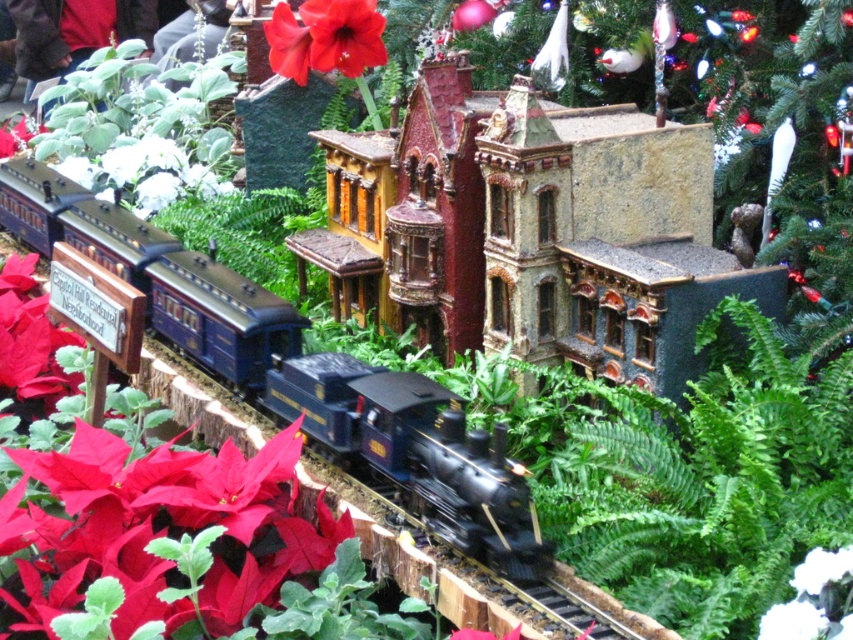
Question: Which of the following is the farthest from the observer?

Choices:
 (A) shiny blue locomotive at center
 (B) red matte poinsettia at upper center

Answer: (B)

Question: Is shiny blue locomotive at center to the right of red matte poinsettia at upper center from the viewer's perspective?

Choices:
 (A) yes
 (B) no

Answer: (B)

Question: Can you confirm if shiny blue locomotive at center is bigger than red matte poinsettia at upper center?

Choices:
 (A) no
 (B) yes

Answer: (B)

Question: Is shiny blue locomotive at center bigger than red matte poinsettia at upper center?

Choices:
 (A) no
 (B) yes

Answer: (B)

Question: Which point is farther from the camera taking this photo?

Choices:
 (A) (370, 54)
 (B) (190, 348)

Answer: (A)